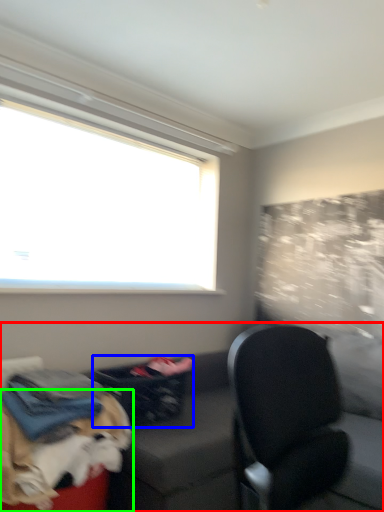
Question: Which object is the closest to the studio couch (highlighted by a red box)? Choose among these: laundry basket (highlighted by a blue box) or dog (highlighted by a green box).

Choices:
 (A) laundry basket
 (B) dog

Answer: (B)